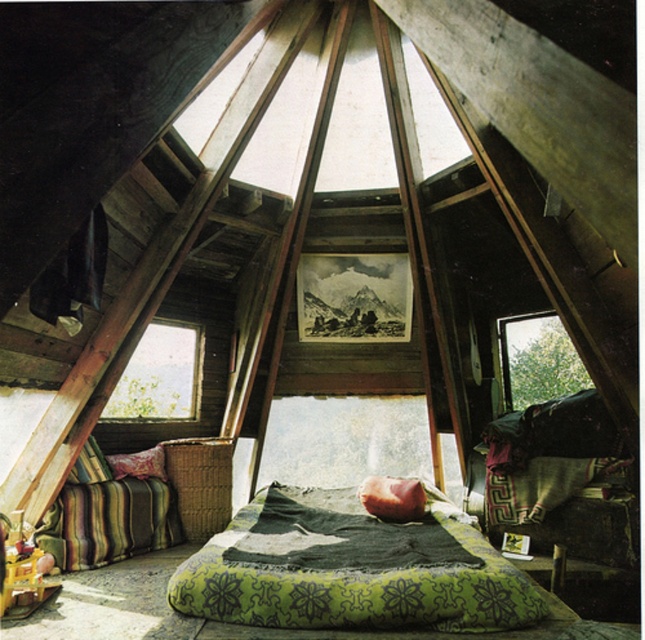
Who is more distant from viewer, (132,381) or (139,472)?

The point (132,381) is behind.

Which is behind, point (192, 330) or point (139, 461)?

Point (192, 330)

At what (x,y) coordinates should I click in order to perform the action: click on transparent glass window at lower left. Please return your answer as a coordinate pair (x, y). The height and width of the screenshot is (640, 645). Looking at the image, I should click on (159, 376).

Is transparent glass window at lower left to the right of striped fabric pillow at lower left from the viewer's perspective?

Correct, you'll find transparent glass window at lower left to the right of striped fabric pillow at lower left.

Can you confirm if transparent glass window at lower left is wider than striped fabric pillow at lower left?

Indeed, transparent glass window at lower left has a greater width compared to striped fabric pillow at lower left.

Between point (183, 336) and point (88, 445), which one is positioned in front?

Point (88, 445) is in front.

At what (x,y) coordinates should I click in order to perform the action: click on transparent glass window at lower left. Please return your answer as a coordinate pair (x, y). Looking at the image, I should click on (159, 376).

Between soft pink fabric pillow at center and velvet green pillow at lower left, which one is positioned higher?

Positioned higher is velvet green pillow at lower left.

Is soft pink fabric pillow at center positioned in front of velvet green pillow at lower left?

Yes, soft pink fabric pillow at center is closer to the viewer.

Is point (372, 484) positioned after point (144, 458)?

No, it is in front of (144, 458).

Where is `soft pink fabric pillow at center`? This screenshot has height=640, width=645. soft pink fabric pillow at center is located at coordinates (392, 497).